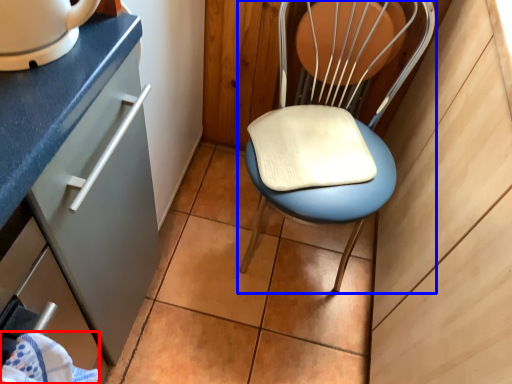
Question: Which point is further to the camera, material (highlighted by a red box) or chair (highlighted by a blue box)?

Choices:
 (A) material
 (B) chair

Answer: (B)